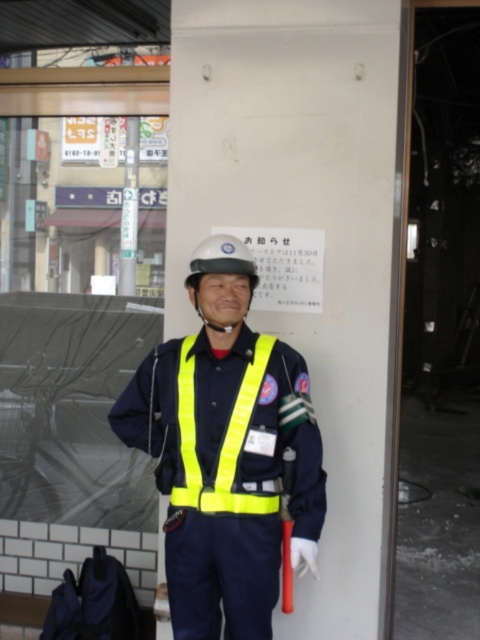
What do you see at coordinates (226, 452) in the screenshot?
I see `yellow reflective vest at center` at bounding box center [226, 452].

Is yellow reflective vest at center further to camera compared to yellow reflective safety vest at center?

No.

Locate an element on the screen. yellow reflective vest at center is located at coordinates (226, 452).